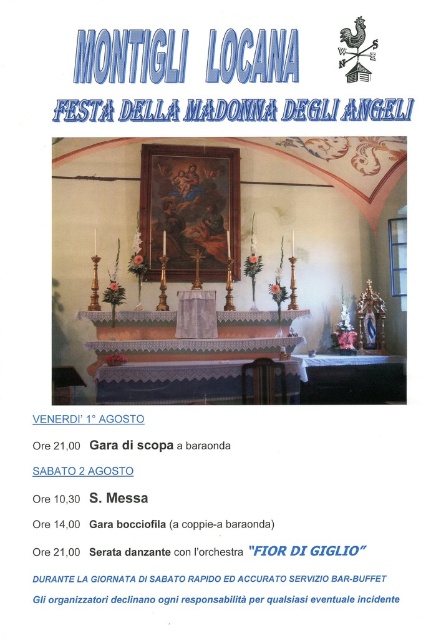
You are standing in front of the altar at the Festa della Madonna degli Angeli event. There are two points marked on the poster at coordinates point (x=234, y=116) and point (x=87, y=602). If you want to place a small decoration closer to the viewer, which point should you choose?

Point (x=234, y=116) is further to the viewer than point (x=87, y=602), so you should choose point (x=234, y=116) to place the decoration closer to the viewer.

You are an event planner organizing the Festa della Madonna degli Angeli. You need to place a new decorative item on the black paper at lower center. However, you want to ensure it won not block the view of the matte gold altar at center from the front entrance. Is this possible?

The black paper at lower center is behind the matte gold altar at center, so placing a decorative item on the black paper at lower center would not block the view of the matte gold altar at center from the front entrance.